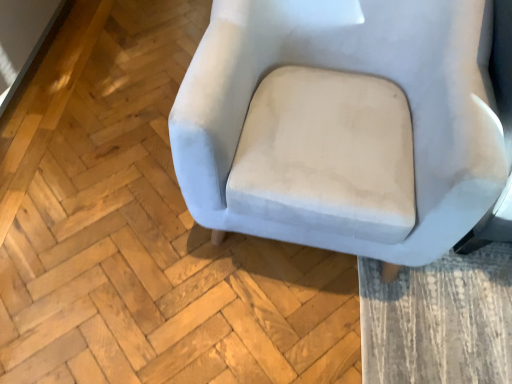
At what (x,y) coordinates should I click in order to perform the action: click on suede-like light blue chair at center. Please return your answer as a coordinate pair (x, y). This screenshot has height=384, width=512. Looking at the image, I should click on (350, 71).

What do you see at coordinates (350, 71) in the screenshot? Image resolution: width=512 pixels, height=384 pixels. I see `suede-like light blue chair at center` at bounding box center [350, 71].

You are a GUI agent. You are given a task and a screenshot of the screen. Output one action in this format:
    pyautogui.click(x=<x>, y=<y>)
    Task: Click on the suede-like light blue chair at center
    This screenshot has width=512, height=384.
    Given the screenshot: What is the action you would take?
    pyautogui.click(x=350, y=71)